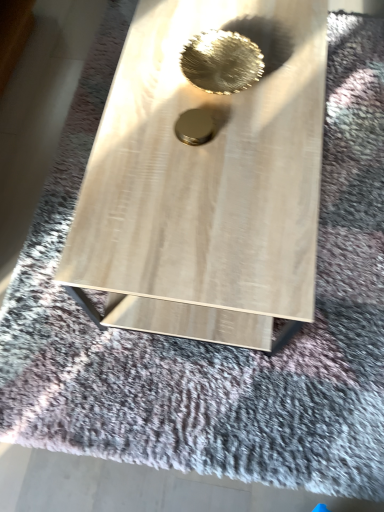
Where is `free spot behind metallic gold bowl at center, arranged as the first hole when viewed from the top`? This screenshot has height=512, width=384. free spot behind metallic gold bowl at center, arranged as the first hole when viewed from the top is located at coordinates (218, 20).